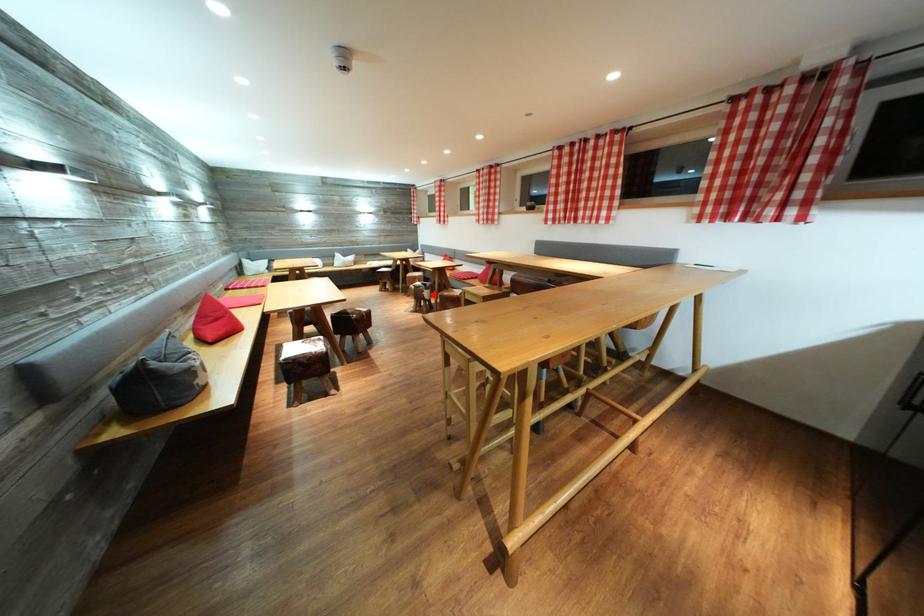
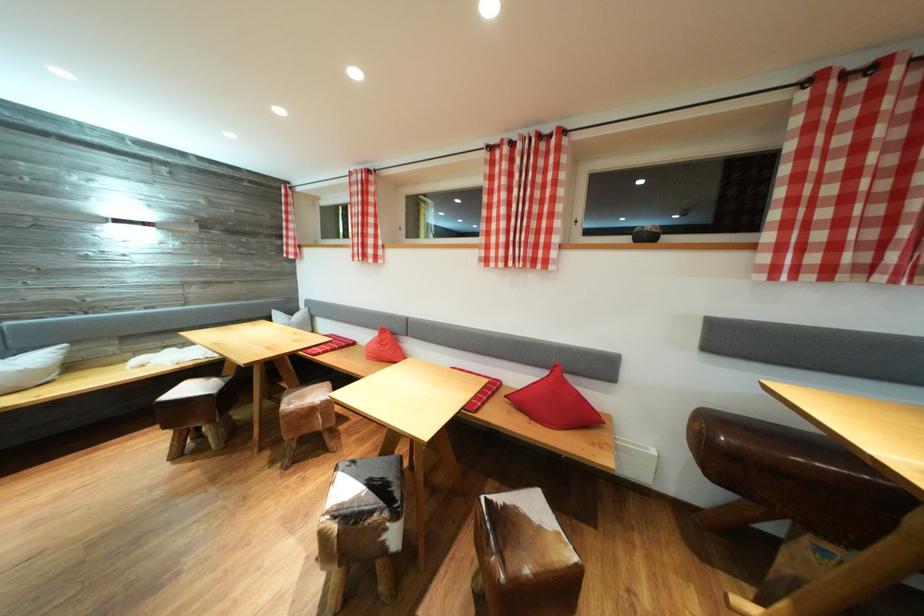
In the second image, find the point that corresponds to the highlighted location in the first image.

(403, 522)